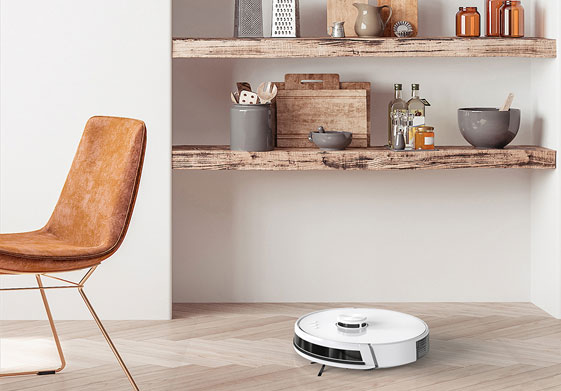
I want to click on jar, so click(x=471, y=16).